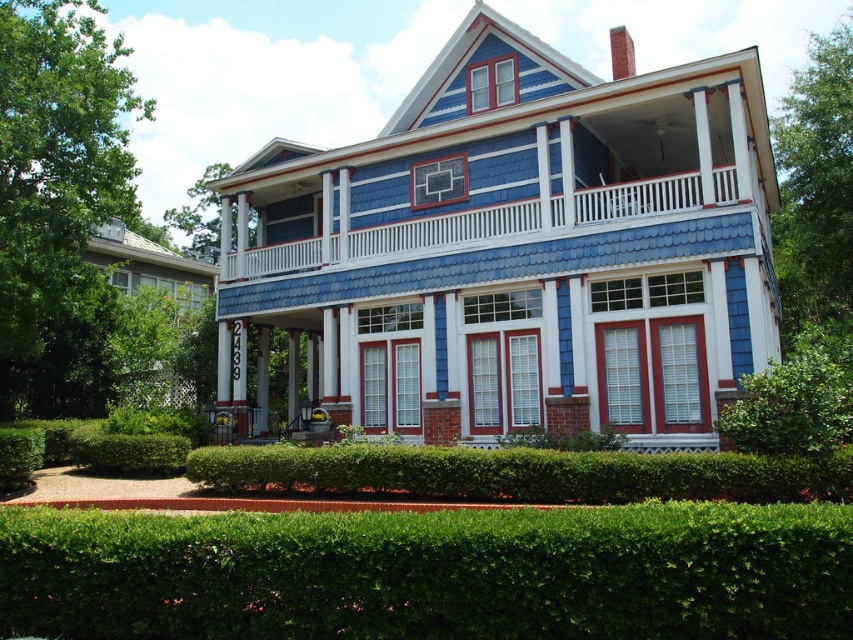
Question: Is green leafy hedge at lower center wider than blue shingles at upper center?

Choices:
 (A) no
 (B) yes

Answer: (A)

Question: Estimate the real-world distances between objects in this image. Which object is closer to the green leafy hedge at center?

Choices:
 (A) green leafy bush at lower right
 (B) green leafy hedge at lower center
 (C) blue shingles at upper center

Answer: (A)

Question: Among these points, which one is farthest from the camera?

Choices:
 (A) (280, 518)
 (B) (368, 241)
 (C) (827, 456)

Answer: (B)

Question: Which point is farther to the camera?

Choices:
 (A) (228, 486)
 (B) (795, 449)
 (C) (730, 195)
 (D) (329, 520)

Answer: (C)

Question: Does green leafy hedge at lower center appear under green leafy bush at lower right?

Choices:
 (A) no
 (B) yes

Answer: (B)

Question: Is green leafy hedge at center above blue shingles at upper center?

Choices:
 (A) yes
 (B) no

Answer: (B)